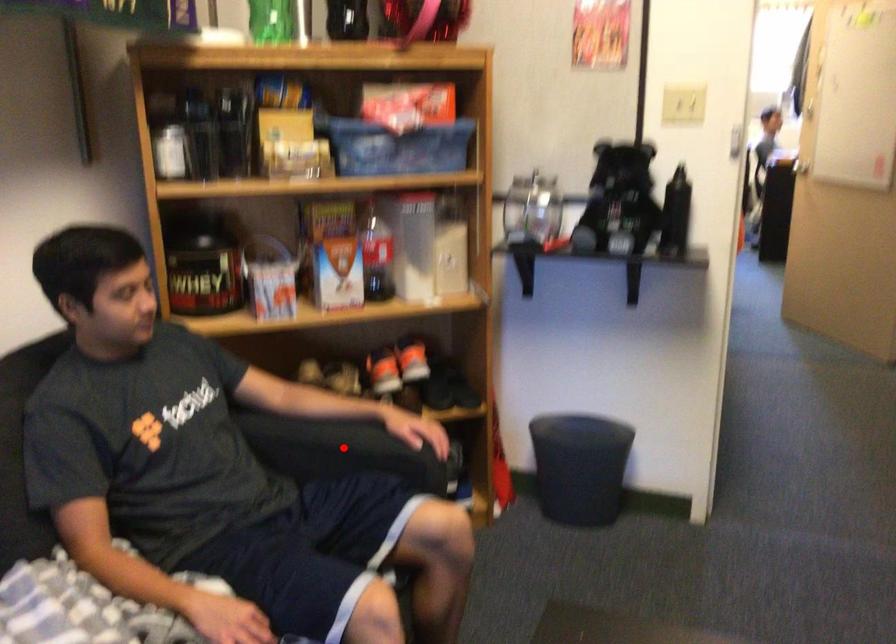
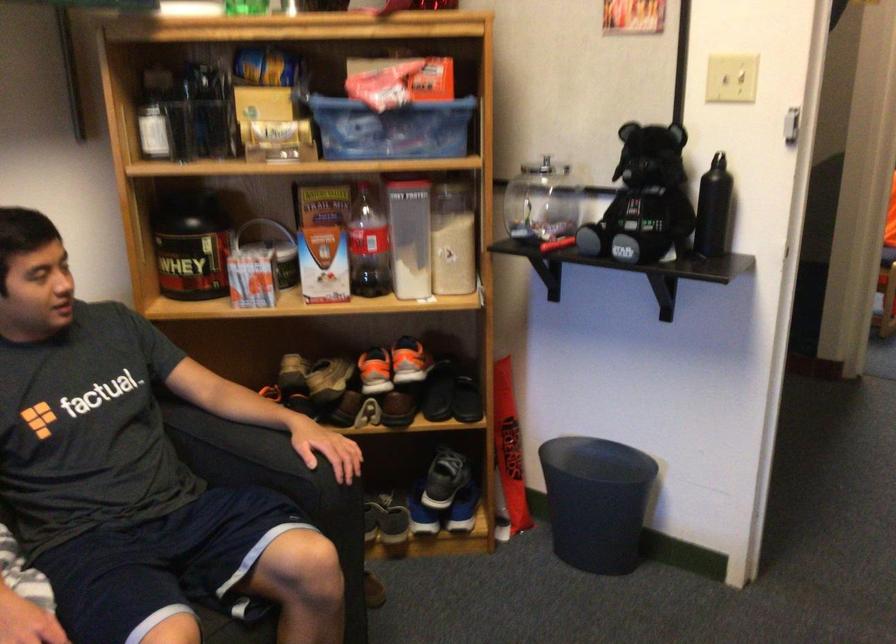
The point at the highlighted location is marked in the first image. Where is the corresponding point in the second image?

(250, 455)